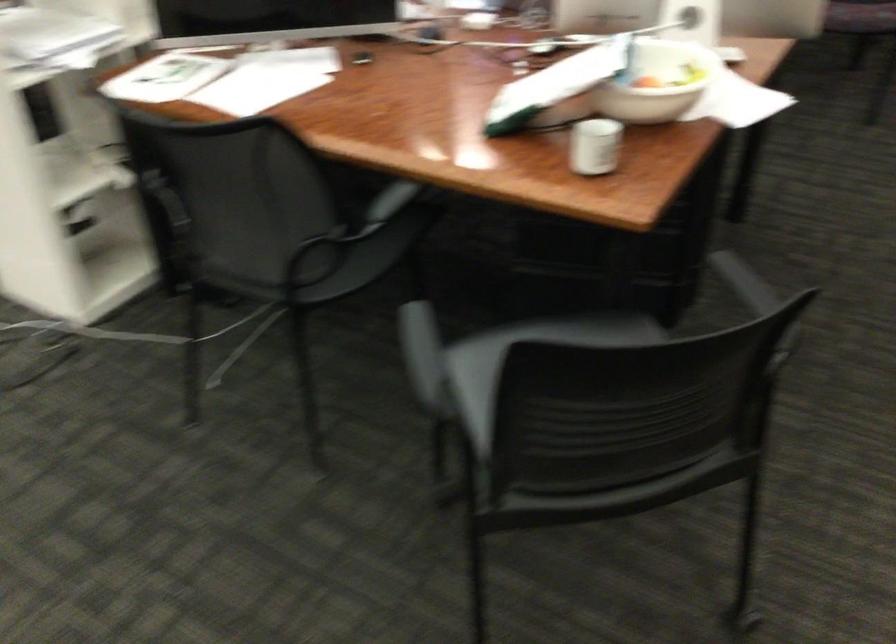
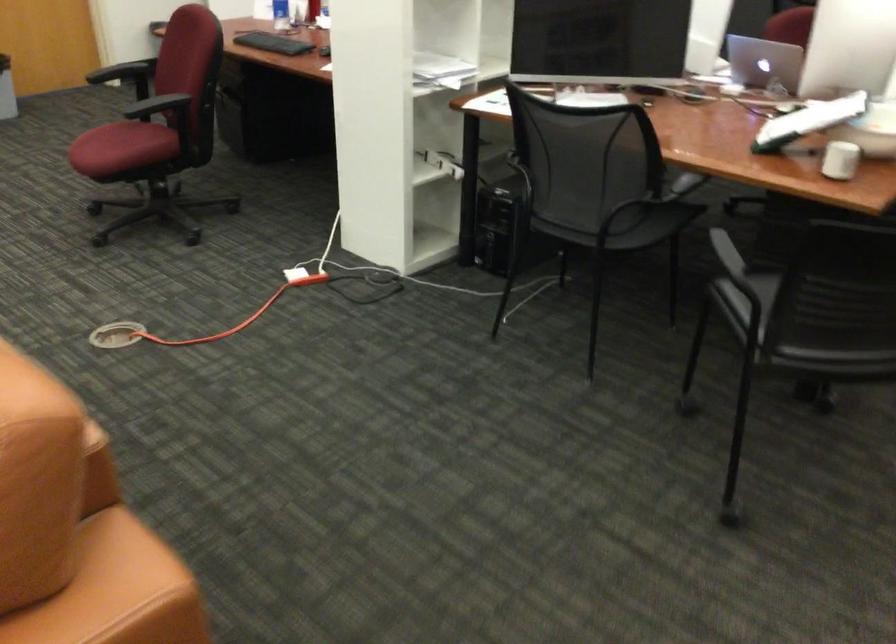
Locate, in the second image, the point that corresponds to [319,268] in the first image.

(615, 223)